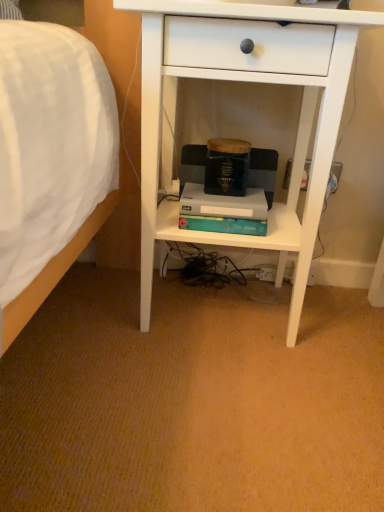
This screenshot has height=512, width=384. I want to click on vacant space underneath white matte desk at center (from a real-world perspective), so click(220, 308).